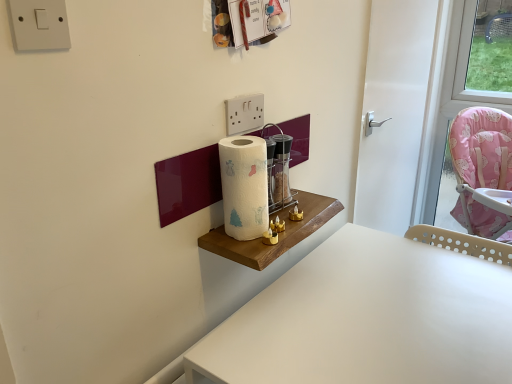
Question: From a real-world perspective, is white plastic/light switch at upper center physically located above or below white paper towel at center?

Choices:
 (A) below
 (B) above

Answer: (B)

Question: In the image, is white plastic/light switch at upper center positioned in front of or behind white paper towel at center?

Choices:
 (A) front
 (B) behind

Answer: (B)

Question: Considering the real-world distances, which object is farthest from the white plastic switch at upper left?

Choices:
 (A) white plastic/light switch at upper center
 (B) white glossy door at center
 (C) white plastic table at lower right
 (D) transparent glass wine bottle at center
 (E) white paper towel at center

Answer: (B)

Question: Which object is the farthest from the white plastic table at lower right?

Choices:
 (A) transparent glass wine bottle at center
 (B) white glossy door at center
 (C) white paper towel at center
 (D) white plastic/light switch at upper center
 (E) white plastic switch at upper left

Answer: (E)